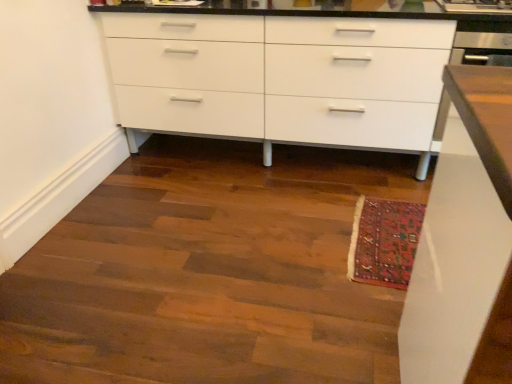
At what (x,y) coordinates should I click in order to perform the action: click on white glossy cabinet at center. Please return your answer as a coordinate pair (x, y). The image size is (512, 384). Looking at the image, I should click on (280, 77).

Consider the image. How different are the orientations of wooden floor at lower center and carpeted mat at lower right in degrees?

They differ by 0.666 degrees in their facing directions.

There is a carpeted mat at lower right. Where is `stairwell above it (from a real-world perspective)`? The image size is (512, 384). stairwell above it (from a real-world perspective) is located at coordinates (208, 273).

Looking at this image, is there a large distance between wooden floor at lower center and carpeted mat at lower right?

wooden floor at lower center is near carpeted mat at lower right, not far away.

Which is closer, (97, 269) or (380, 216)?

Point (97, 269) is positioned closer to the camera compared to point (380, 216).

From a real-world perspective, is carpeted mat at lower right on wooden floor at lower center?

No, from a real-world perspective, carpeted mat at lower right is not on top of wooden floor at lower center.

Considering the relative sizes of carpeted mat at lower right and wooden floor at lower center in the image provided, is carpeted mat at lower right shorter than wooden floor at lower center?

Incorrect, the height of carpeted mat at lower right does not fall short of that of wooden floor at lower center.

Where is `mat below the wooden floor at lower center (from the image's perspective)`? mat below the wooden floor at lower center (from the image's perspective) is located at coordinates pyautogui.click(x=384, y=241).

Looking at this image, between carpeted mat at lower right and wooden floor at lower center, which one has larger size?

wooden floor at lower center.

Which is farther from the camera, [377,247] or [405,38]?

Positioned behind is point [405,38].

Based on the photo, considering the relative sizes of carpeted mat at lower right and white glossy cabinet at center in the image provided, is carpeted mat at lower right shorter than white glossy cabinet at center?

Indeed, carpeted mat at lower right has a lesser height compared to white glossy cabinet at center.

Is carpeted mat at lower right turned away from white glossy cabinet at center?

No, white glossy cabinet at center is not at the back of carpeted mat at lower right.

From the image's perspective, which one is positioned lower, carpeted mat at lower right or white glossy cabinet at center?

carpeted mat at lower right.

In order to click on mat in front of the white glossy cabinet at center in this screenshot , I will do pyautogui.click(x=384, y=241).

Which of these two, white glossy cabinet at center or carpeted mat at lower right, stands shorter?

Standing shorter between the two is carpeted mat at lower right.

How many degrees apart are the facing directions of white glossy cabinet at center and carpeted mat at lower right?

The angular difference between white glossy cabinet at center and carpeted mat at lower right is 89.3 degrees.

How different are the orientations of white glossy cabinet at center and wooden floor at lower center in degrees?

The facing directions of white glossy cabinet at center and wooden floor at lower center are 90 degrees apart.

Does point (165, 104) come behind point (278, 254)?

Yes.

Where is `stairwell that is on the left side of white glossy cabinet at center`? stairwell that is on the left side of white glossy cabinet at center is located at coordinates (208, 273).

Which is more to the right, white glossy cabinet at center or wooden floor at lower center?

Positioned to the right is white glossy cabinet at center.

Which of these two, wooden floor at lower center or white glossy cabinet at center, is bigger?

Bigger between the two is white glossy cabinet at center.

Where is `stairwell below the white glossy cabinet at center (from a real-world perspective)`? This screenshot has height=384, width=512. stairwell below the white glossy cabinet at center (from a real-world perspective) is located at coordinates (208, 273).

In the scene shown: Relative to white glossy cabinet at center, is wooden floor at lower center in front or behind?

wooden floor at lower center is in front of white glossy cabinet at center.

Looking at this image, is wooden floor at lower center far from white glossy cabinet at center?

wooden floor at lower center is actually quite close to white glossy cabinet at center.

Locate an element on the screen. This screenshot has height=384, width=512. stairwell on the left side of carpeted mat at lower right is located at coordinates (208, 273).

Where is `stairwell lying above the carpeted mat at lower right (from the image's perspective)`? stairwell lying above the carpeted mat at lower right (from the image's perspective) is located at coordinates (208, 273).

Looking at the image, which one is located further to wooden floor at lower center, carpeted mat at lower right or white glossy cabinet at center?

Among the two, white glossy cabinet at center is located further to wooden floor at lower center.

Looking at the image, which one is located further to carpeted mat at lower right, white glossy cabinet at center or wooden floor at lower center?

white glossy cabinet at center is positioned further to the anchor carpeted mat at lower right.

Consider the image. Looking at the image, which one is located further to white glossy cabinet at center, carpeted mat at lower right or wooden floor at lower center?

The object further to white glossy cabinet at center is carpeted mat at lower right.

Considering their positions, is wooden floor at lower center positioned further to white glossy cabinet at center than carpeted mat at lower right?

carpeted mat at lower right.

From the image, which object appears to be nearer to wooden floor at lower center, white glossy cabinet at center or carpeted mat at lower right?

The object closer to wooden floor at lower center is carpeted mat at lower right.

From the image, which object appears to be farther from carpeted mat at lower right, wooden floor at lower center or white glossy cabinet at center?

white glossy cabinet at center lies further to carpeted mat at lower right than the other object.

At what (x,y) coordinates should I click in order to perform the action: click on stairwell between white glossy cabinet at center and carpeted mat at lower right in the up-down direction. Please return your answer as a coordinate pair (x, y). The width and height of the screenshot is (512, 384). Looking at the image, I should click on (208, 273).